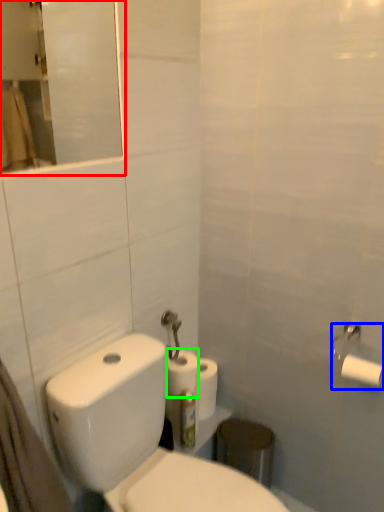
Question: Which object is the closest to the mirror (highlighted by a red box)? Choose among these: toilet paper (highlighted by a blue box) or toilet paper (highlighted by a green box).

Choices:
 (A) toilet paper
 (B) toilet paper

Answer: (B)